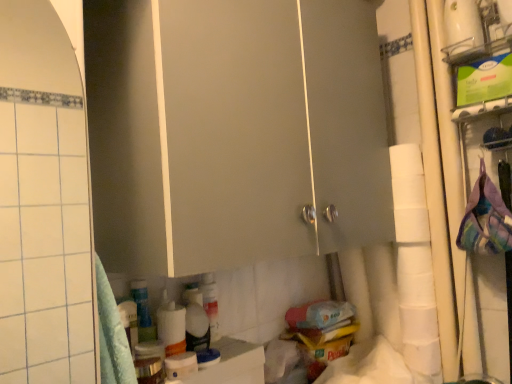
Question: Is white matte toilet paper at right located outside matte white cabinet at center?

Choices:
 (A) yes
 (B) no

Answer: (A)

Question: From the image's perspective, is white matte toilet paper at right located beneath matte white cabinet at center?

Choices:
 (A) yes
 (B) no

Answer: (A)

Question: Is white matte toilet paper at right thinner than matte white cabinet at center?

Choices:
 (A) no
 (B) yes

Answer: (B)

Question: Is white matte toilet paper at right positioned far away from matte white cabinet at center?

Choices:
 (A) no
 (B) yes

Answer: (A)

Question: Is white matte toilet paper at right to the right of matte white cabinet at center from the viewer's perspective?

Choices:
 (A) yes
 (B) no

Answer: (A)

Question: Is white matte toilet paper at right turned away from matte white cabinet at center?

Choices:
 (A) no
 (B) yes

Answer: (A)

Question: Is matte white cabinet at center wider than white matte toilet paper at right?

Choices:
 (A) yes
 (B) no

Answer: (A)

Question: Does matte white cabinet at center lie behind white matte toilet paper at right?

Choices:
 (A) yes
 (B) no

Answer: (B)

Question: Does matte white cabinet at center turn towards white matte toilet paper at right?

Choices:
 (A) yes
 (B) no

Answer: (B)

Question: Considering the relative sizes of matte white cabinet at center and white matte toilet paper at right in the image provided, is matte white cabinet at center thinner than white matte toilet paper at right?

Choices:
 (A) no
 (B) yes

Answer: (A)

Question: Is there a large distance between matte white cabinet at center and white matte toilet paper at right?

Choices:
 (A) no
 (B) yes

Answer: (A)

Question: Is matte white cabinet at center to the right of white matte toilet paper at right from the viewer's perspective?

Choices:
 (A) no
 (B) yes

Answer: (A)

Question: Considering the positions of point (413, 196) and point (223, 19), is point (413, 196) closer or farther from the camera than point (223, 19)?

Choices:
 (A) closer
 (B) farther

Answer: (B)